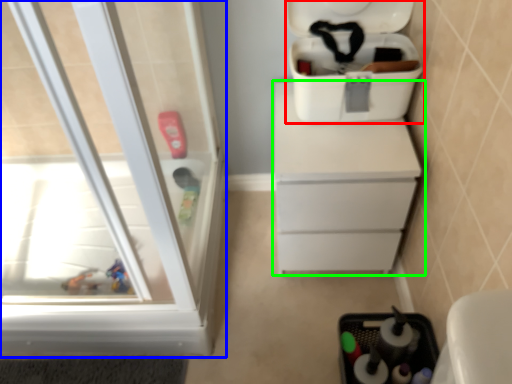
Question: Which is farther away from cooler (highlighted by a red box)? screen door (highlighted by a blue box) or chest of drawers (highlighted by a green box)?

Choices:
 (A) screen door
 (B) chest of drawers

Answer: (A)